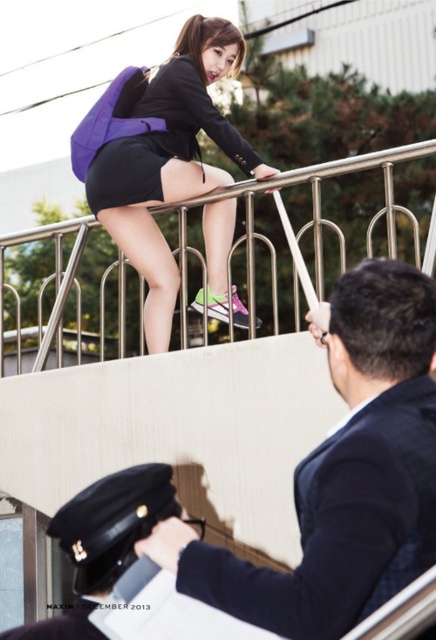
Question: Estimate the real-world distances between objects in this image. Which object is farther from the black leather cap at upper center?

Choices:
 (A) dark blue suit at upper right
 (B) brushed metal railing at upper center
 (C) matte purple backpack at upper center
 (D) matte black blazer at upper center

Answer: (D)

Question: Can you confirm if black leather cap at upper center is positioned to the left of matte black blazer at upper center?

Choices:
 (A) no
 (B) yes

Answer: (B)

Question: Which of the following is the closest to the observer?

Choices:
 (A) black leather cap at upper center
 (B) dark blue suit at upper right
 (C) matte black blazer at upper center
 (D) brushed metal railing at upper center

Answer: (B)

Question: Is black leather cap at upper center to the right of matte black blazer at upper center from the viewer's perspective?

Choices:
 (A) no
 (B) yes

Answer: (A)

Question: Among these objects, which one is farthest from the camera?

Choices:
 (A) dark blue suit at upper right
 (B) brushed metal railing at upper center
 (C) matte purple backpack at upper center

Answer: (C)

Question: Is dark blue suit at upper right bigger than black leather cap at upper center?

Choices:
 (A) yes
 (B) no

Answer: (A)